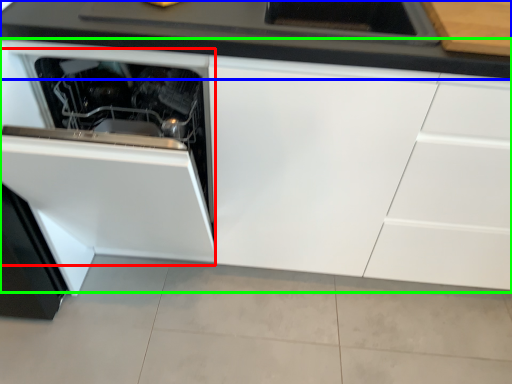
Question: Which object is positioned farthest from oven (highlighted by a red box)? Select from countertop (highlighted by a blue box) and cabinetry (highlighted by a green box).

Choices:
 (A) countertop
 (B) cabinetry

Answer: (A)